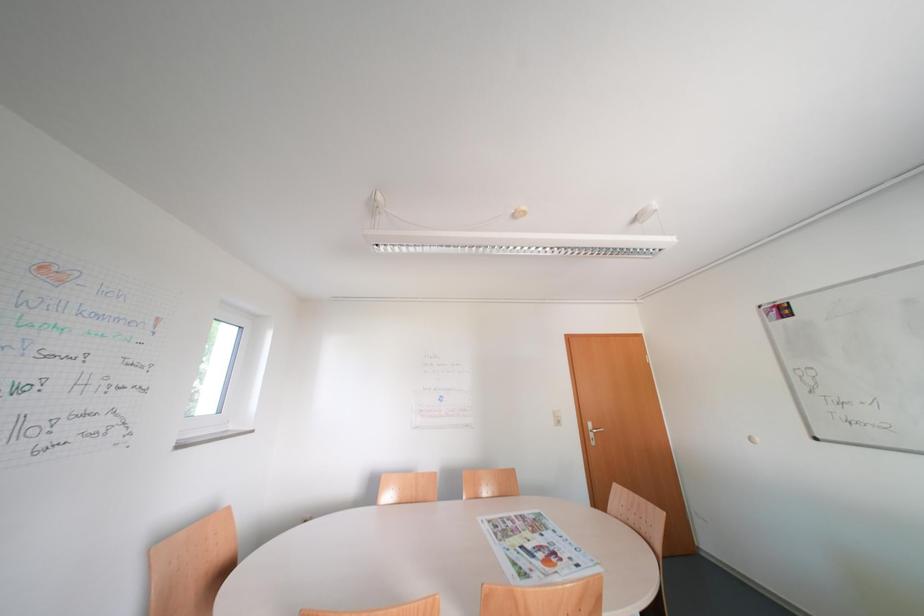
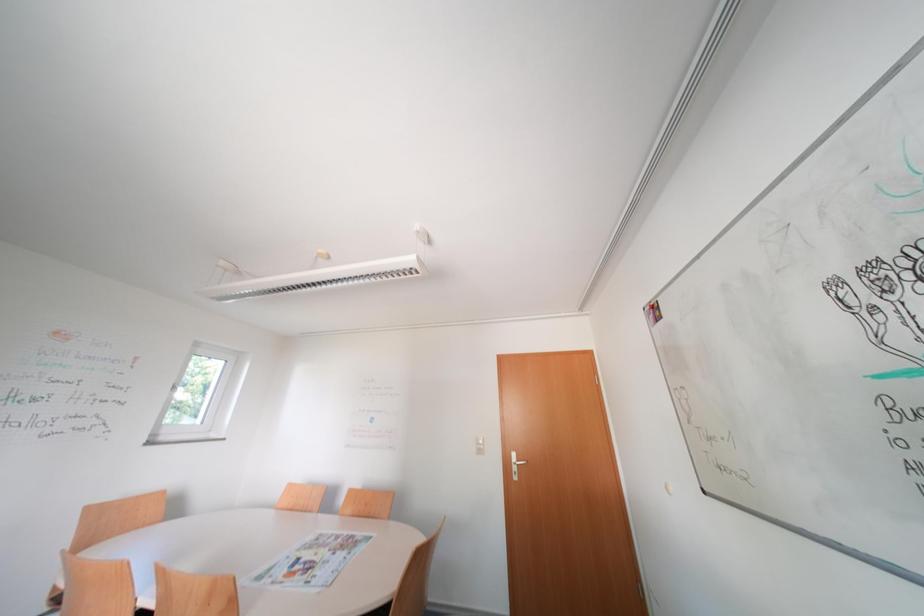
Question: The images are taken continuously from a first-person perspective. In which direction are you moving?

Choices:
 (A) Left
 (B) Right
 (C) Forward
 (D) Backward

Answer: (B)